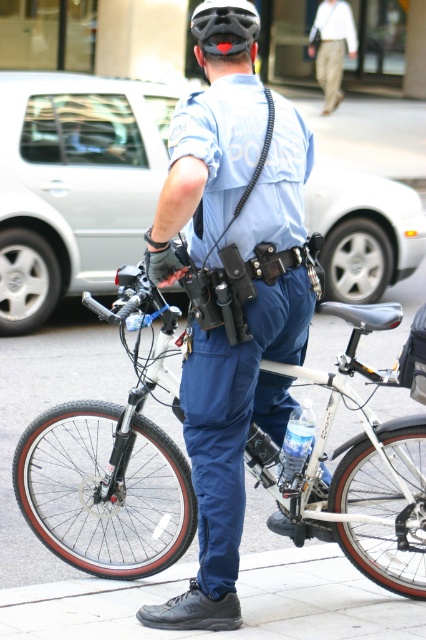
Can you confirm if silver metallic bicycle at center is taller than khaki cotton pants at upper center?

Incorrect, silver metallic bicycle at center's height is not larger of khaki cotton pants at upper center's.

Is silver metallic bicycle at center to the right of khaki cotton pants at upper center from the viewer's perspective?

In fact, silver metallic bicycle at center is to the left of khaki cotton pants at upper center.

Image resolution: width=426 pixels, height=640 pixels. What do you see at coordinates (109, 480) in the screenshot?
I see `silver metallic bicycle at center` at bounding box center [109, 480].

In order to click on silver metallic bicycle at center in this screenshot , I will do `click(109, 480)`.

Does khaki cotton pants at upper center have a greater height compared to black matte helmet at center?

Correct, khaki cotton pants at upper center is much taller as black matte helmet at center.

Who is lower down, khaki cotton pants at upper center or black matte helmet at center?

black matte helmet at center is below.

Image resolution: width=426 pixels, height=640 pixels. I want to click on khaki cotton pants at upper center, so [331, 48].

Is blue uniform at center bigger than black matte helmet at center?

Yes, blue uniform at center is bigger than black matte helmet at center.

Does blue uniform at center have a lesser width compared to black matte helmet at center?

No.

Between point (256, 125) and point (219, 4), which one is positioned behind?

Positioned behind is point (256, 125).

You are a GUI agent. You are given a task and a screenshot of the screen. Output one action in this format:
    pyautogui.click(x=<x>, y=<y>)
    Task: Click on the blue uniform at center
    This screenshot has height=640, width=426.
    Given the screenshot: What is the action you would take?
    pyautogui.click(x=232, y=301)